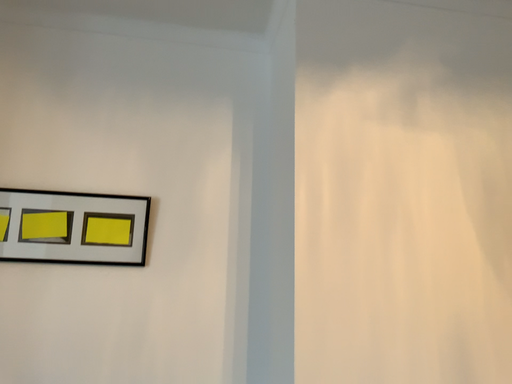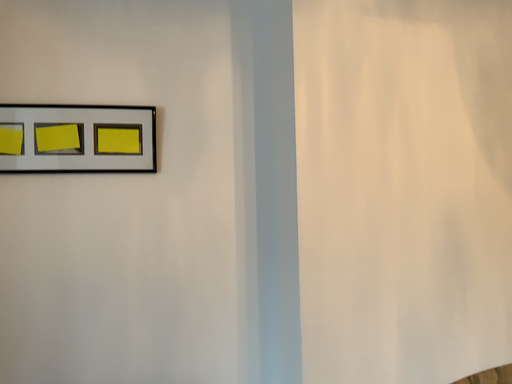
Question: Which way did the camera rotate in the video?

Choices:
 (A) rotated downward
 (B) rotated upward

Answer: (A)